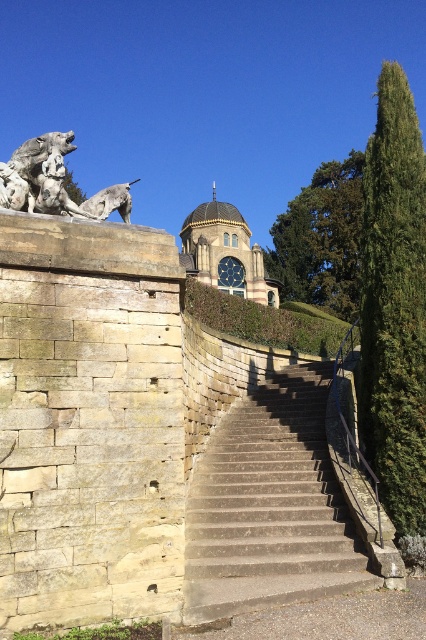
You are standing at the bottom of the stone staircase and want to plant a new shrub. The coordinates for the green textured hedge at right are given. Where should you place the new shrub to ensure it aligns with the existing hedge?

The green textured hedge at right is located at point (394, 305), so you should place the new shrub near those coordinates to align with the existing hedge.

You are standing at the bottom of the stone staircase and want to look at both the gray stone lion at upper left and the gold metallic clock at center. Which object should you look towards first if you want to see them in the order they appear from left to right in the scene?

You should look towards the gray stone lion at upper left first because it is positioned to the left of the gold metallic clock at center, making it the leftmost object in the scene.